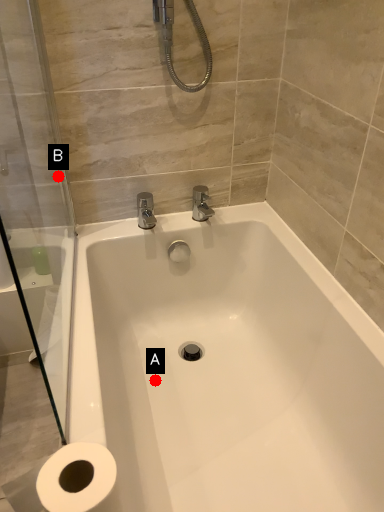
Question: Two points are circled on the image, labeled by A and B beside each circle. Which of the following is the closest to the observer?

Choices:
 (A) A is closer
 (B) B is closer

Answer: (B)